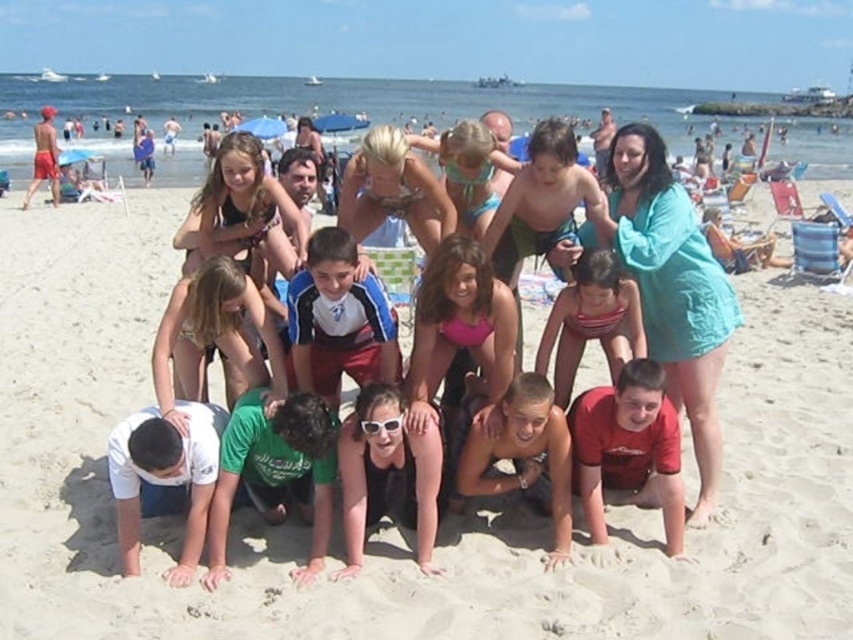
Is beige sandy beach at center to the right of striped swimsuit at center from the viewer's perspective?

In fact, beige sandy beach at center is to the left of striped swimsuit at center.

Which is above, beige sandy beach at center or striped swimsuit at center?

beige sandy beach at center

Is point (334, 586) closer to camera compared to point (637, 305)?

Yes, point (334, 586) is in front of point (637, 305).

Image resolution: width=853 pixels, height=640 pixels. In order to click on beige sandy beach at center in this screenshot , I will do `click(393, 529)`.

Who is taller, teal fabric shirt at upper right or red matte shirt at lower center?

red matte shirt at lower center is taller.

Which is in front, point (675, 189) or point (642, 400)?

Point (642, 400)

Who is more distant from viewer, (659, 241) or (659, 417)?

The point (659, 241) is behind.

The width and height of the screenshot is (853, 640). What are the coordinates of `teal fabric shirt at upper right` in the screenshot? It's located at (671, 289).

Can you confirm if beige sandy beach at center is thinner than red matte shirt at lower center?

No, beige sandy beach at center is not thinner than red matte shirt at lower center.

Between beige sandy beach at center and red matte shirt at lower center, which one is positioned higher?

beige sandy beach at center

The image size is (853, 640). I want to click on beige sandy beach at center, so click(x=393, y=529).